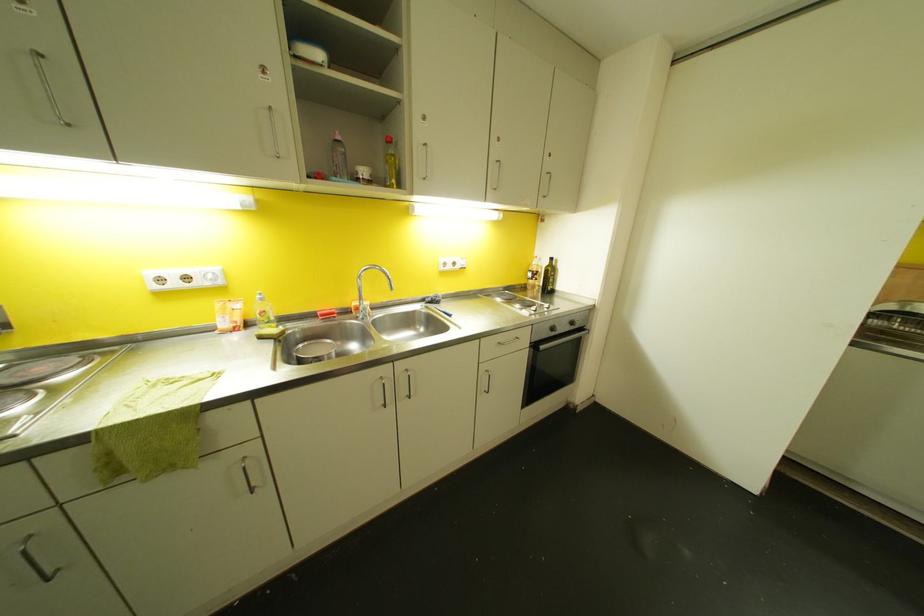
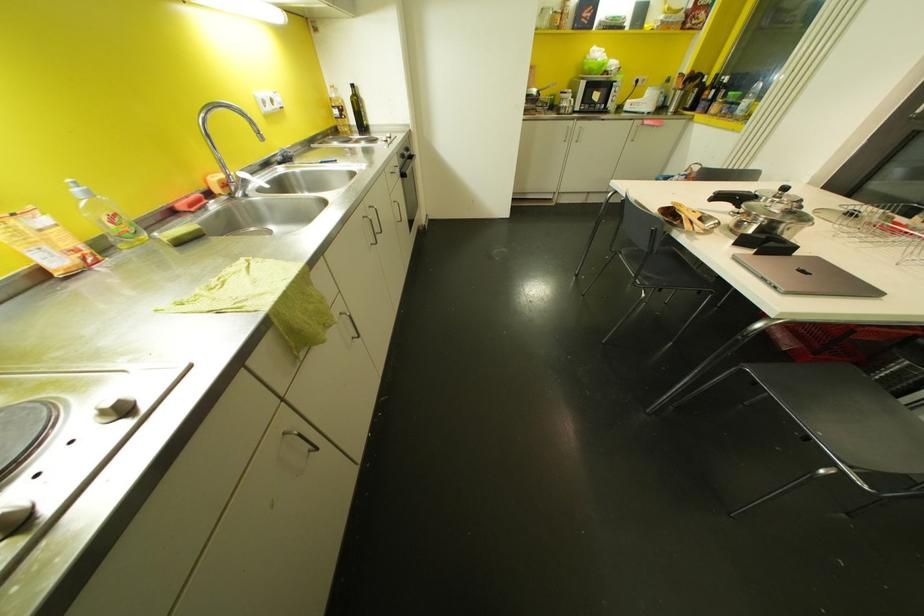
Locate, in the second image, the point that corresponds to [244,456] in the first image.

(339, 314)